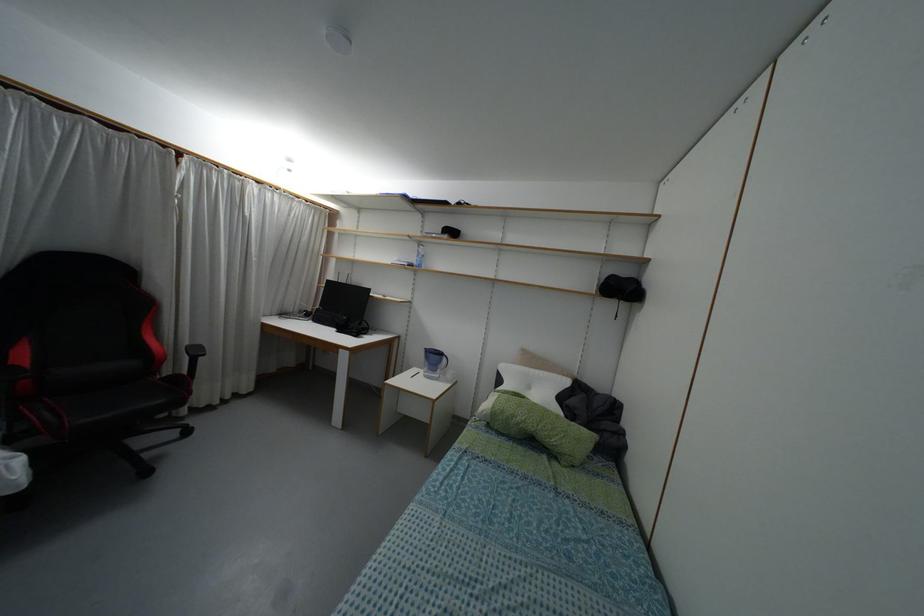
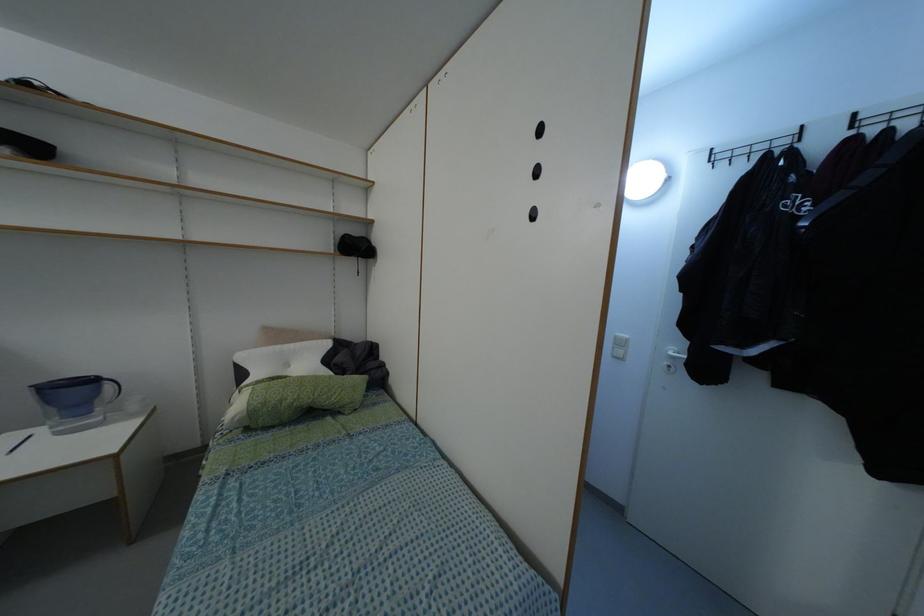
Question: The first image is from the beginning of the video and the second image is from the end. How did the camera likely rotate when shooting the video?

Choices:
 (A) Left
 (B) Right
 (C) Up
 (D) Down

Answer: (B)